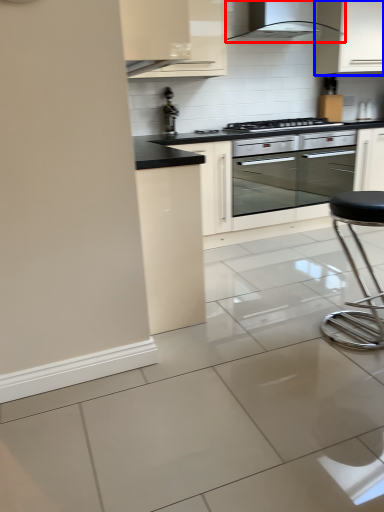
Question: Which of the following is the closest to the observer, home appliance (highlighted by a red box) or cabinetry (highlighted by a blue box)?

Choices:
 (A) home appliance
 (B) cabinetry

Answer: (A)